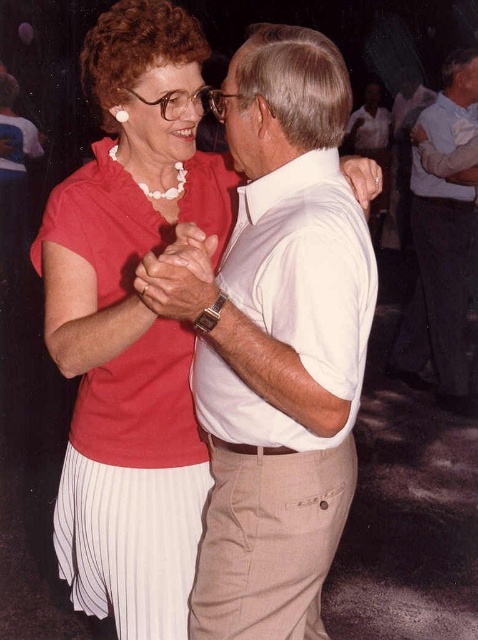
Question: Considering the relative positions of matte red dress at center and white cotton shirt at upper center in the image provided, where is matte red dress at center located with respect to white cotton shirt at upper center?

Choices:
 (A) below
 (B) above

Answer: (A)

Question: Does matte white blouse at center have a greater width compared to white cotton shirt at upper center?

Choices:
 (A) no
 (B) yes

Answer: (A)

Question: Among these points, which one is farthest from the camera?

Choices:
 (A) (169, 621)
 (B) (460, 104)
 (C) (152, 609)

Answer: (B)

Question: Is matte red dress at center to the right of white cotton shirt at upper center from the viewer's perspective?

Choices:
 (A) no
 (B) yes

Answer: (A)

Question: Which object appears farthest from the camera in this image?

Choices:
 (A) matte white blouse at center
 (B) white cotton shirt at upper center
 (C) matte red dress at center

Answer: (B)

Question: Which of the following is the farthest from the observer?

Choices:
 (A) matte white blouse at center
 (B) white cotton shirt at upper center
 (C) matte red dress at center

Answer: (B)